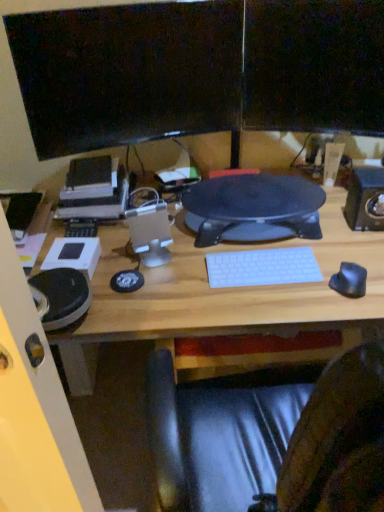
Locate an element on the screen. Image resolution: width=384 pixels, height=512 pixels. unoccupied area in front of black rubber mouse at right is located at coordinates (353, 309).